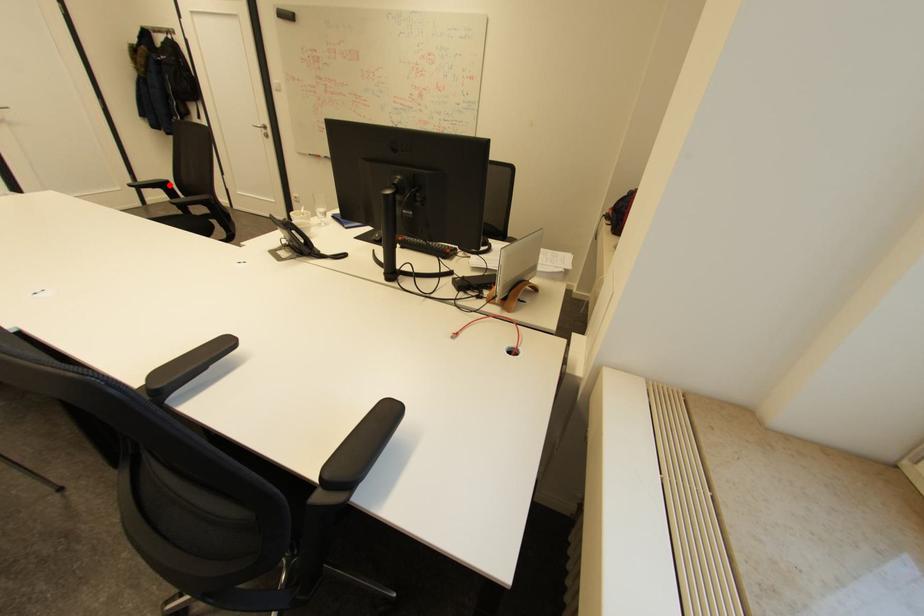
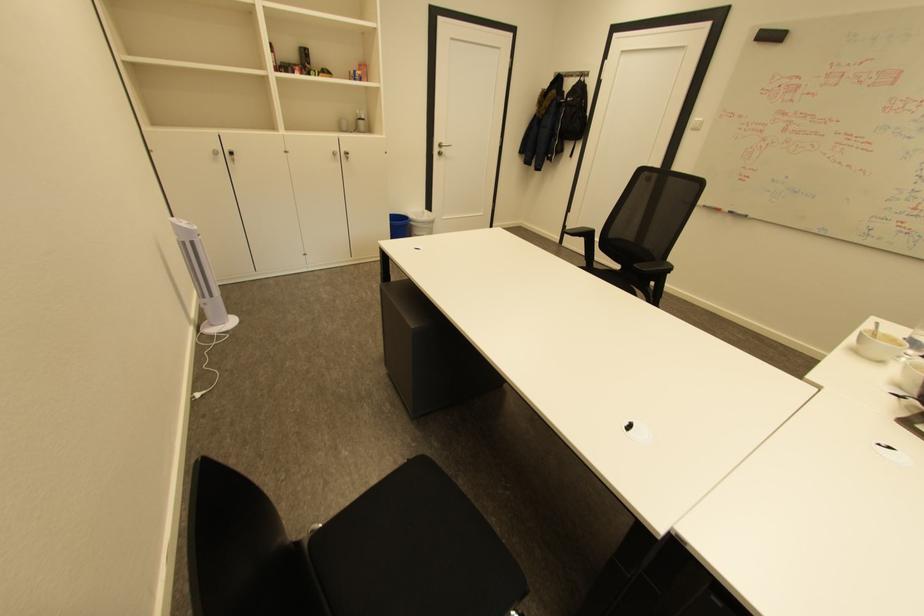
In the second image, find the point that corresponds to the highlighted location in the first image.

(594, 233)